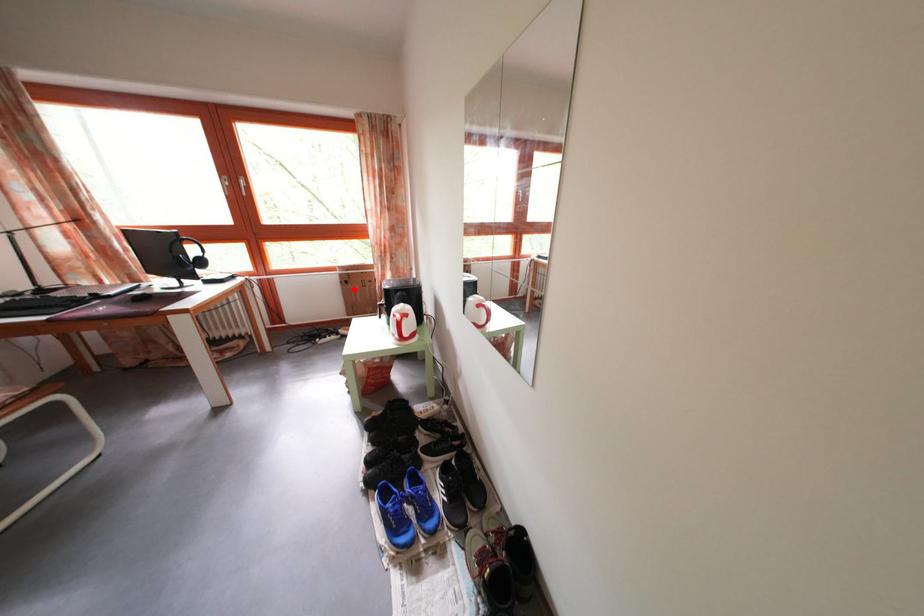
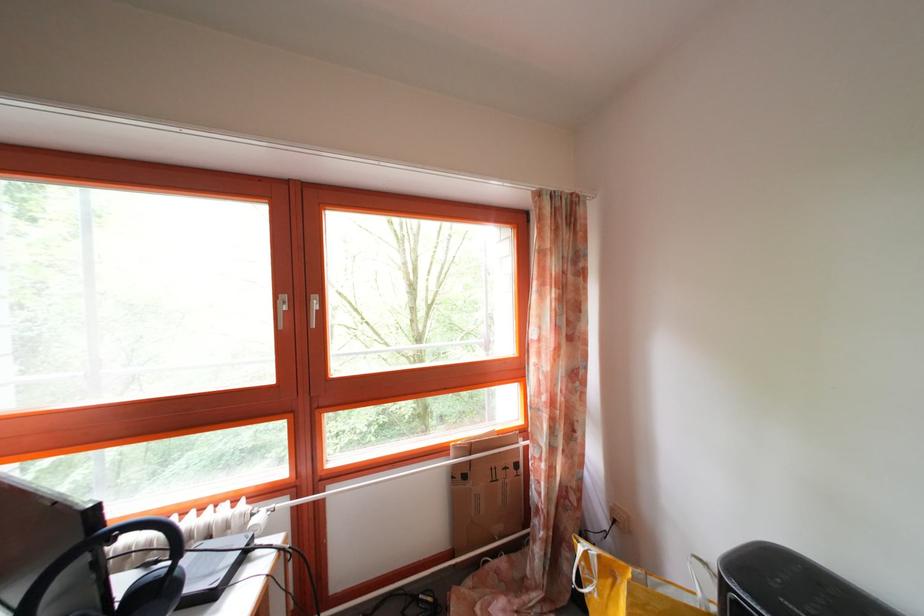
Question: A red point is marked in image1. In image2, is the corresponding 3D point closer to the camera or farther? Reply with the corresponding letter.

Choices:
 (A) The corresponding 3D point is closer.
 (B) The corresponding 3D point is farther.

Answer: (B)